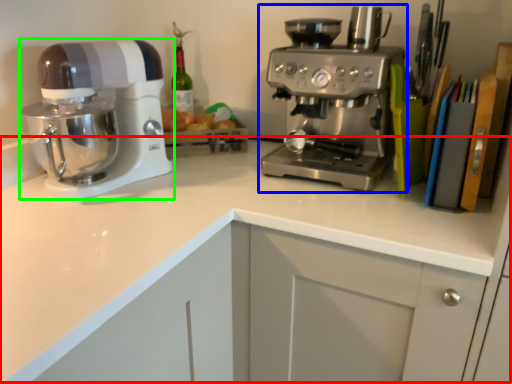
Question: Estimate the real-world distances between objects in this image. Which object is closer to counter top (highlighted by a red box), coffee maker (highlighted by a blue box) or mixer (highlighted by a green box)?

Choices:
 (A) coffee maker
 (B) mixer

Answer: (A)